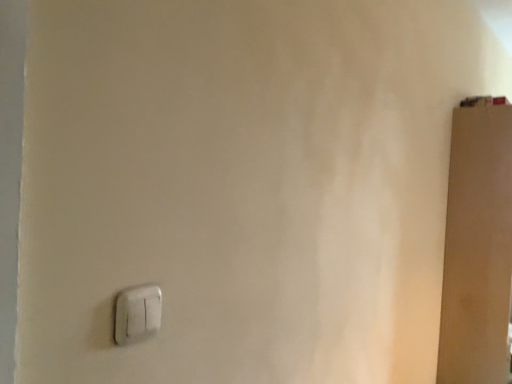
I want to click on white plastic light switch at lower left, so click(137, 314).

The height and width of the screenshot is (384, 512). Describe the element at coordinates (137, 314) in the screenshot. I see `white plastic light switch at lower left` at that location.

What is the approximate height of white plastic light switch at lower left?

It is 3.40 inches.

Measure the distance between point (462, 237) and camera.

The depth of point (462, 237) is 6.45 feet.

Where is `brown matte door at right`? Image resolution: width=512 pixels, height=384 pixels. brown matte door at right is located at coordinates (477, 245).

What do you see at coordinates (477, 245) in the screenshot? The image size is (512, 384). I see `brown matte door at right` at bounding box center [477, 245].

You are a GUI agent. You are given a task and a screenshot of the screen. Output one action in this format:
    pyautogui.click(x=<x>, y=<y>)
    Task: Click on the white plastic light switch at lower left
    The image size is (512, 384).
    Given the screenshot: What is the action you would take?
    pyautogui.click(x=137, y=314)

Does brown matte door at right appear on the right side of white plastic light switch at lower left?

Yes, brown matte door at right is to the right of white plastic light switch at lower left.

Is the position of brown matte door at right more distant than that of white plastic light switch at lower left?

Yes, brown matte door at right is behind white plastic light switch at lower left.

Is point (459, 158) more distant than point (116, 300)?

Yes, point (459, 158) is behind point (116, 300).

From the image's perspective, is brown matte door at right beneath white plastic light switch at lower left?

Yes, from the image's perspective, brown matte door at right is beneath white plastic light switch at lower left.

From a real-world perspective, is brown matte door at right positioned over white plastic light switch at lower left based on gravity?

No, from a real-world perspective, brown matte door at right is not over white plastic light switch at lower left

Can you confirm if brown matte door at right is wider than white plastic light switch at lower left?

Indeed, brown matte door at right has a greater width compared to white plastic light switch at lower left.

Does brown matte door at right have a greater height compared to white plastic light switch at lower left?

Indeed, brown matte door at right has a greater height compared to white plastic light switch at lower left.

Does brown matte door at right have a larger size compared to white plastic light switch at lower left?

Indeed, brown matte door at right has a larger size compared to white plastic light switch at lower left.

Is brown matte door at right surrounding white plastic light switch at lower left?

Definitely not — white plastic light switch at lower left is not inside brown matte door at right.

Are brown matte door at right and white plastic light switch at lower left making contact?

No, brown matte door at right is not making contact with white plastic light switch at lower left.

Is brown matte door at right positioned with its back to white plastic light switch at lower left?

brown matte door at right does not have its back to white plastic light switch at lower left.

What's the angular difference between brown matte door at right and white plastic light switch at lower left's facing directions?

0.00243 degrees.

I want to click on light switch in front of the brown matte door at right, so click(137, 314).

Looking at this image, considering the positions of objects white plastic light switch at lower left and brown matte door at right in the image provided, who is more to the right, white plastic light switch at lower left or brown matte door at right?

Positioned to the right is brown matte door at right.

Relative to brown matte door at right, is white plastic light switch at lower left in front or behind?

In the image, white plastic light switch at lower left appears in front of brown matte door at right.

Between point (140, 311) and point (499, 203), which one is positioned in front?

The point (140, 311) is in front.

From the image's perspective, is white plastic light switch at lower left located above or below brown matte door at right?

white plastic light switch at lower left is above brown matte door at right.

From a real-world perspective, between white plastic light switch at lower left and brown matte door at right, who is vertically lower?

brown matte door at right, from a real-world perspective.

Between white plastic light switch at lower left and brown matte door at right, which one has larger width?

Wider between the two is brown matte door at right.

Is white plastic light switch at lower left taller or shorter than brown matte door at right?

Considering their sizes, white plastic light switch at lower left has less height than brown matte door at right.

Considering the relative sizes of white plastic light switch at lower left and brown matte door at right in the image provided, is white plastic light switch at lower left bigger than brown matte door at right?

No.

Is white plastic light switch at lower left situated inside brown matte door at right or outside?

The correct answer is: outside.

Is white plastic light switch at lower left not close to brown matte door at right?

Yes, white plastic light switch at lower left and brown matte door at right are located far from each other.

Is white plastic light switch at lower left facing towards brown matte door at right?

No, white plastic light switch at lower left is not aimed at brown matte door at right.

Can you tell me how much white plastic light switch at lower left and brown matte door at right differ in facing direction?

The angle between the facing direction of white plastic light switch at lower left and the facing direction of brown matte door at right is 0.00243 degrees.

Measure the distance from white plastic light switch at lower left to brown matte door at right.

white plastic light switch at lower left is 5.69 feet away from brown matte door at right.

Locate an element on the screen. door on the right of white plastic light switch at lower left is located at coordinates (477, 245).

Find the location of `door beneath the white plastic light switch at lower left (from a real-world perspective)`. door beneath the white plastic light switch at lower left (from a real-world perspective) is located at coordinates (477, 245).

Find the location of a particular element. light switch above the brown matte door at right (from a real-world perspective) is located at coordinates 137,314.